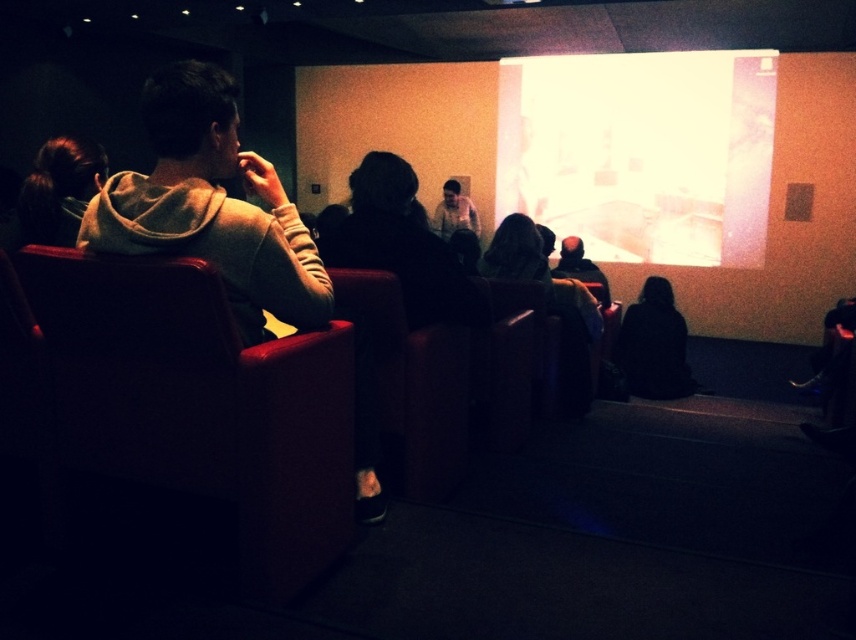
Between dark brown hair at left and black fabric at lower right, which one appears on the left side from the viewer's perspective?

dark brown hair at left is more to the left.

Can you confirm if dark brown hair at left is wider than black fabric at lower right?

In fact, dark brown hair at left might be narrower than black fabric at lower right.

Where is `dark brown hair at left`? This screenshot has width=856, height=640. dark brown hair at left is located at coordinates (58, 189).

Find the location of `dark brown hair at left`. dark brown hair at left is located at coordinates [x=58, y=189].

Does leather-like armchair at left appear under black fabric at lower right?

Yes.

Is point (105, 515) closer to viewer compared to point (658, 324)?

Yes, point (105, 515) is closer to viewer.

Image resolution: width=856 pixels, height=640 pixels. In order to click on leather-like armchair at left in this screenshot , I will do `click(192, 422)`.

Which is more to the right, leather-like armchair at left or dark brown hair at left?

leather-like armchair at left is more to the right.

Which is below, leather-like armchair at left or dark brown hair at left?

leather-like armchair at left is below.

Which is behind, point (310, 410) or point (24, 179)?

The point (24, 179) is more distant.

Image resolution: width=856 pixels, height=640 pixels. I want to click on leather-like armchair at left, so click(x=192, y=422).